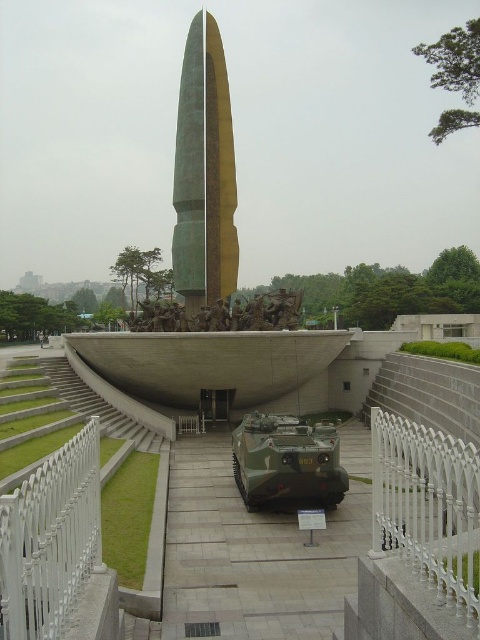
Is point (300, 500) farther from viewer compared to point (265, 310)?

No, (300, 500) is in front of (265, 310).

Can you confirm if camouflage paint tank at center is wider than bronze sculpture at center?

In fact, camouflage paint tank at center might be narrower than bronze sculpture at center.

Who is more distant from viewer, (324, 440) or (299, 296)?

The point (299, 296) is more distant.

I want to click on camouflage paint tank at center, so click(287, 461).

Between bronze sculpture at center and gray concrete stairs at center, which one has less height?

With less height is bronze sculpture at center.

Does bronze sculpture at center have a greater width compared to gray concrete stairs at center?

Yes.

Which is in front, point (291, 310) or point (119, 413)?

Point (119, 413)

The height and width of the screenshot is (640, 480). What are the coordinates of `bronze sculpture at center` in the screenshot? It's located at (226, 314).

Between green polished stone obelisk at center and bronze sculpture at center, which one has less height?

bronze sculpture at center

The width and height of the screenshot is (480, 640). Identify the location of green polished stone obelisk at center. (204, 173).

You are a GUI agent. You are given a task and a screenshot of the screen. Output one action in this format:
    pyautogui.click(x=<x>, y=<y>)
    Task: Click on the green polished stone obelisk at center
    
    Given the screenshot: What is the action you would take?
    pyautogui.click(x=204, y=173)